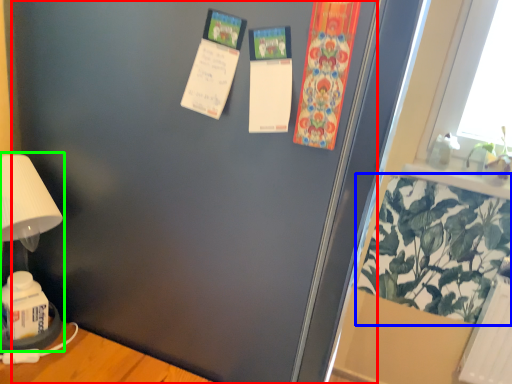
Question: Which object is the closest to the screen door (highlighted by a red box)? Choose among these: plant (highlighted by a blue box) or table lamp (highlighted by a green box).

Choices:
 (A) plant
 (B) table lamp

Answer: (B)